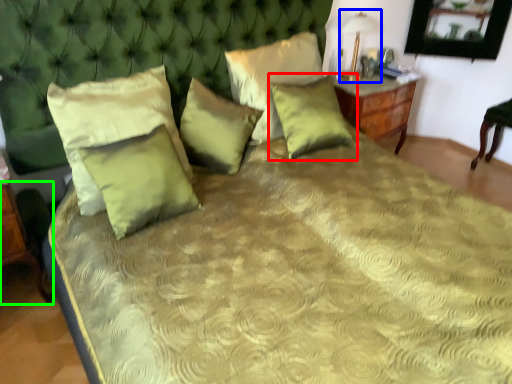
Question: Based on their relative distances, which object is farther from pillow (highlighted by a red box)? Choose from table lamp (highlighted by a blue box) and table (highlighted by a green box).

Choices:
 (A) table lamp
 (B) table

Answer: (B)